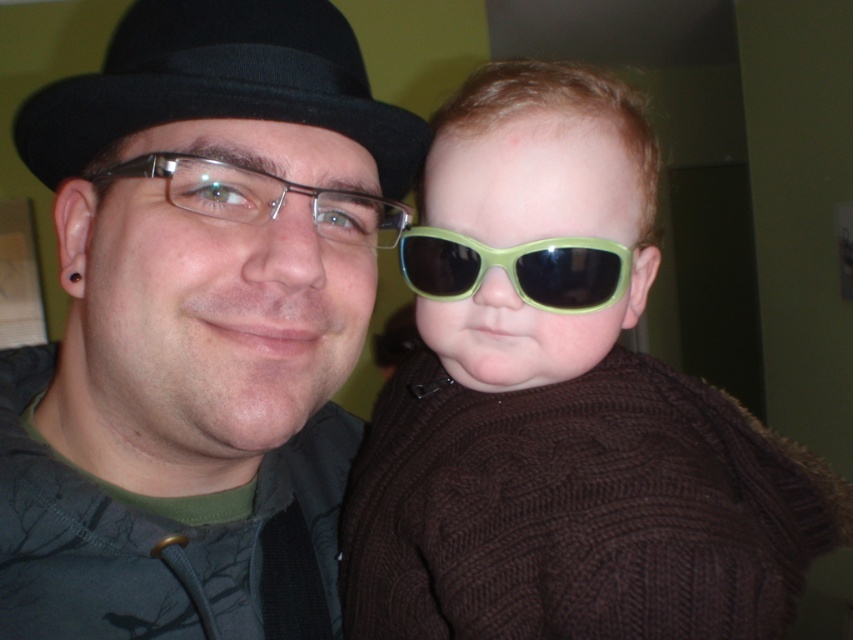
You are a tailor measuring the distance between two accessories for a costume design. The black felt fedora at left and the green plastic sunglasses at center are part of the design. Can the accessories be placed side by side on a display stand that is 5 inches wide without overlapping?

The distance between the black felt fedora at left and green plastic sunglasses at center is 4.86 inches, so they can be placed side by side on a 5 inch wide display stand without overlapping since the required space is slightly less than the stand width.

You are standing in the room and want to hand the green matte sunglasses at center to someone. Which person should you approach, the adult on the left or the child on the right?

The green matte sunglasses at center is located at point (561, 404), which is closer to the child on the right. Therefore, you should approach the child on the right to hand them the sunglasses.